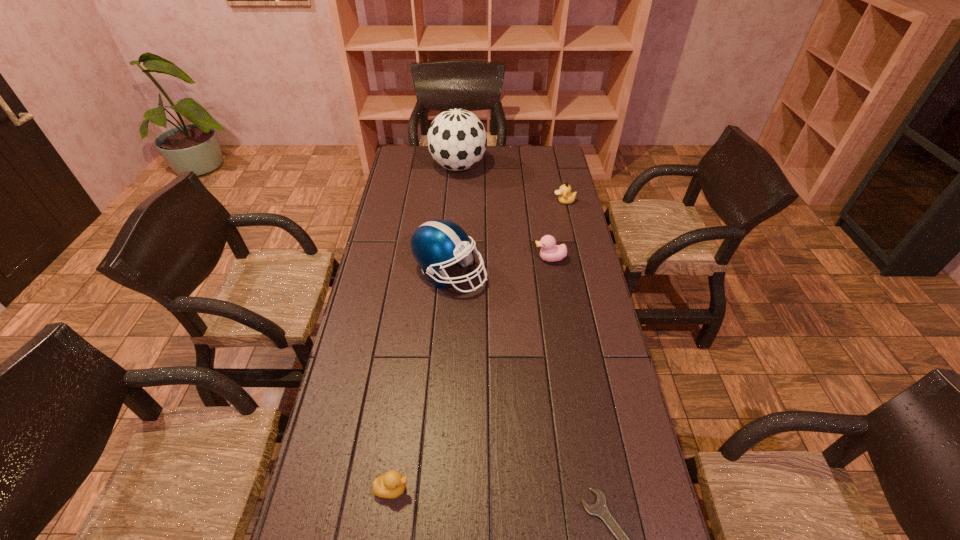
The height and width of the screenshot is (540, 960). In order to click on the tallest object in this screenshot , I will do `click(457, 140)`.

Find the location of a particular element. soccer ball is located at coordinates (457, 140).

This screenshot has height=540, width=960. I want to click on football helmet, so click(434, 244).

Where is `the second nearest duckling`? the second nearest duckling is located at coordinates (549, 252).

Locate an element on the screen. This screenshot has height=540, width=960. the fifth nearest object is located at coordinates click(566, 196).

Where is `the leftmost duckling`? The height and width of the screenshot is (540, 960). the leftmost duckling is located at coordinates (392, 484).

What are the coordinates of `the second shortest object` in the screenshot? It's located at 392,484.

Where is `vacant space situated 0.360m on the front of the tallest object`? vacant space situated 0.360m on the front of the tallest object is located at coordinates [x=454, y=233].

This screenshot has height=540, width=960. In order to click on vacant region located at the front of the fifth shortest object with the faceguard in this screenshot , I will do `click(565, 274)`.

Where is `vacant space located on the front-facing side of the second nearest duckling`? The height and width of the screenshot is (540, 960). vacant space located on the front-facing side of the second nearest duckling is located at coordinates (458, 259).